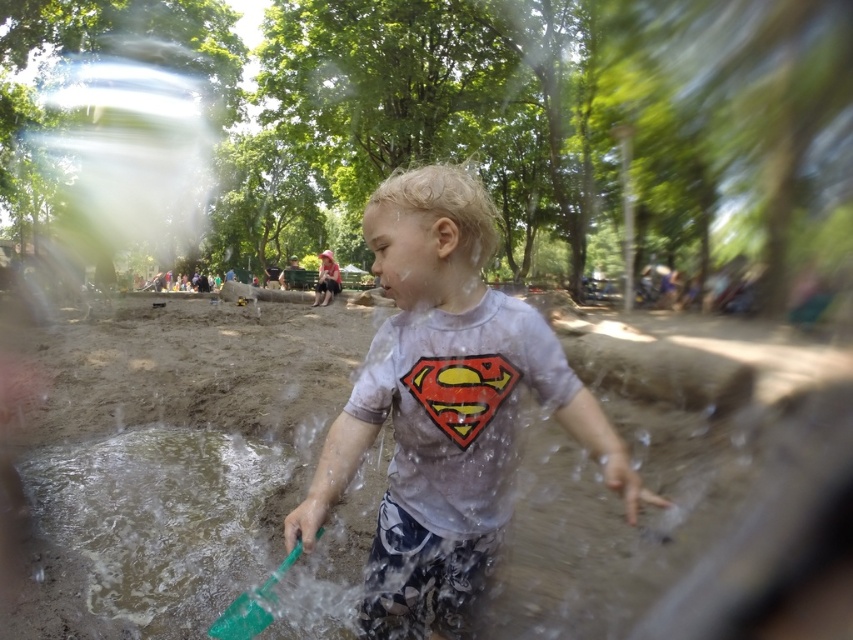
Is point (447, 218) closer to camera compared to point (260, 621)?

No.

Is matte gray t-shirt at center thinner than green plastic shovel at center?

In fact, matte gray t-shirt at center might be wider than green plastic shovel at center.

Who is more forward, (431,240) or (296,541)?

Positioned in front is point (296,541).

The height and width of the screenshot is (640, 853). Identify the location of matte gray t-shirt at center. (445, 406).